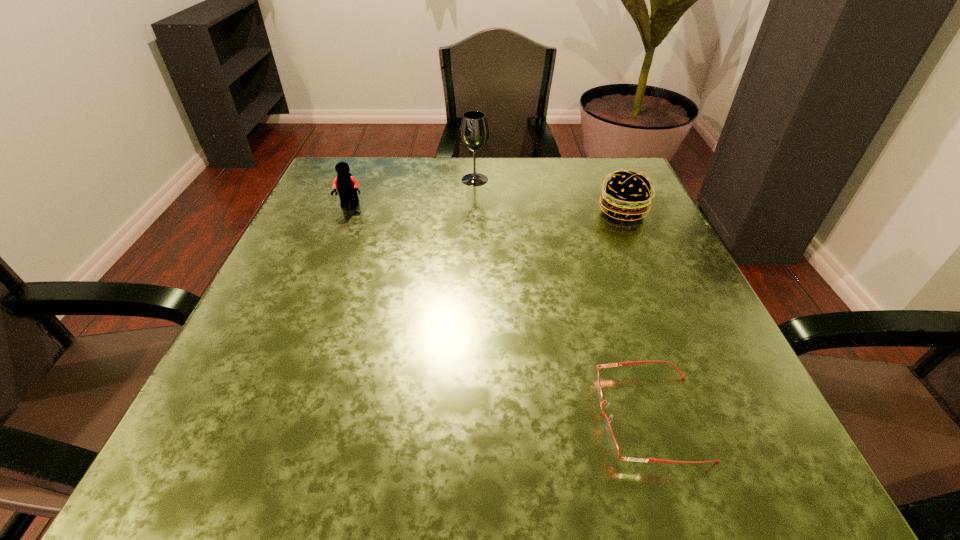
Where is `free space located 0.250m on the lenses of the nearest object`? Image resolution: width=960 pixels, height=540 pixels. free space located 0.250m on the lenses of the nearest object is located at coordinates (412, 417).

At what (x,y) coordinates should I click in order to perform the action: click on vacant point located on the lenses of the nearest object. Please return your answer as a coordinate pair (x, y). Looking at the image, I should click on (345, 417).

You are a GUI agent. You are given a task and a screenshot of the screen. Output one action in this format:
    pyautogui.click(x=<x>, y=<y>)
    Task: Click on the wineglass that is at the far edge
    
    Given the screenshot: What is the action you would take?
    pyautogui.click(x=474, y=132)

Locate an element on the screen. The height and width of the screenshot is (540, 960). Lego that is at the far edge is located at coordinates (347, 186).

Locate an element on the screen. The height and width of the screenshot is (540, 960). patty present at the far edge is located at coordinates (628, 194).

Where is `object situated at the near edge`? The height and width of the screenshot is (540, 960). object situated at the near edge is located at coordinates (612, 441).

At what (x,y) coordinates should I click in order to perform the action: click on object that is at the left edge. Please return your answer as a coordinate pair (x, y). Image resolution: width=960 pixels, height=540 pixels. Looking at the image, I should click on (347, 186).

What are the coordinates of `patty located at the right edge` in the screenshot? It's located at point(628,194).

The image size is (960, 540). What are the coordinates of `spectacles at the right edge` in the screenshot? It's located at (612, 441).

Where is `object present at the far left corner`? The width and height of the screenshot is (960, 540). object present at the far left corner is located at coordinates (347, 186).